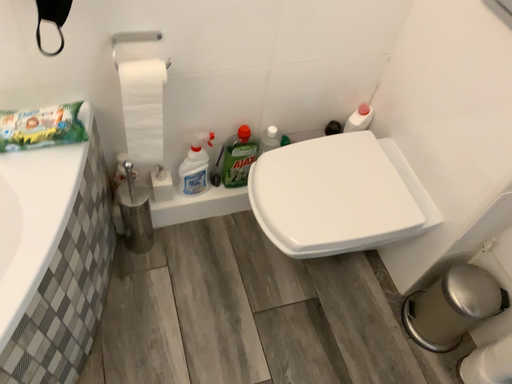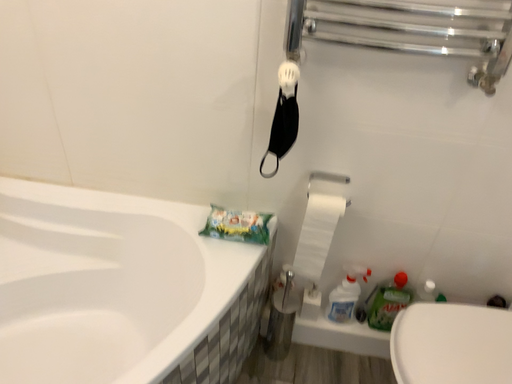
Question: How did the camera likely rotate when shooting the video?

Choices:
 (A) rotated upward
 (B) rotated downward

Answer: (A)